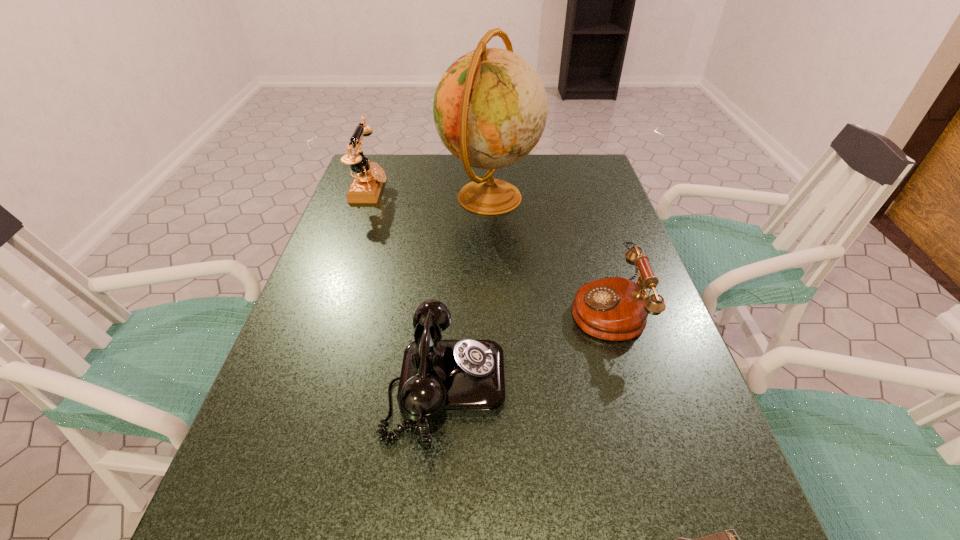
I want to click on blank space located 0.100m on the dial of the second telephone from right to left, so click(x=556, y=384).

Locate an element on the screen. The image size is (960, 540). globe that is at the far edge is located at coordinates (490, 108).

I want to click on telephone present at the far edge, so click(x=366, y=186).

You are a GUI agent. You are given a task and a screenshot of the screen. Output one action in this format:
    pyautogui.click(x=<x>, y=<y>)
    Task: Click on the object that is at the left edge
    This screenshot has height=540, width=960.
    Given the screenshot: What is the action you would take?
    pyautogui.click(x=366, y=186)

Locate an element on the screen. This screenshot has width=960, height=540. object located in the right edge section of the desktop is located at coordinates (616, 309).

Find the location of a particular element. object that is at the far left corner is located at coordinates (366, 186).

In order to click on vacant region at the far edge of the desktop in this screenshot , I will do `click(430, 167)`.

Identify the location of vacant space at the left edge. (341, 273).

The image size is (960, 540). Identify the location of vacant space at the right edge of the desktop. (608, 344).

Locate an element on the screen. This screenshot has height=540, width=960. blank space at the far right corner is located at coordinates (575, 157).